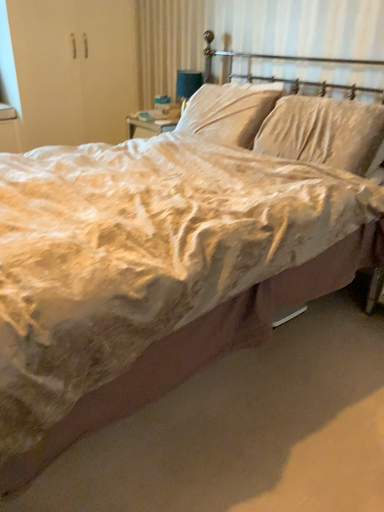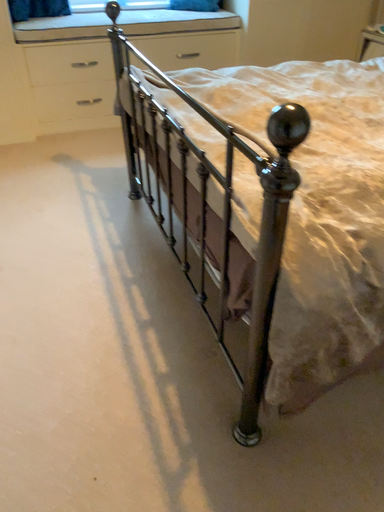
Question: Which way did the camera rotate in the video?

Choices:
 (A) rotated upward
 (B) rotated downward

Answer: (B)